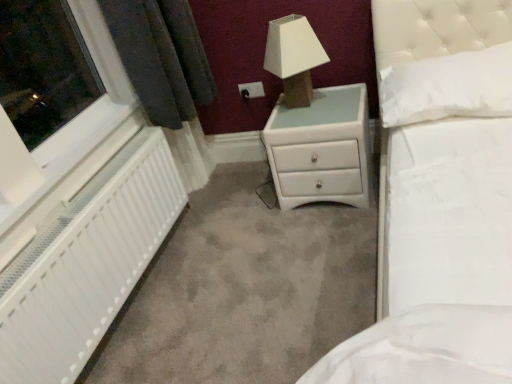
In order to click on white textured radiator at left in this screenshot , I will do `click(87, 264)`.

This screenshot has width=512, height=384. Describe the element at coordinates (54, 97) in the screenshot. I see `white plastic window at left` at that location.

Describe the element at coordinates (448, 87) in the screenshot. I see `white soft pillow at upper right` at that location.

In order to face white glossy chest of drawers at center, should I rotate leftwards or rightwards?

You should rotate right by 8.863 degrees.

This screenshot has width=512, height=384. What do you see at coordinates (321, 148) in the screenshot?
I see `white glossy chest of drawers at center` at bounding box center [321, 148].

You are a GUI agent. You are given a task and a screenshot of the screen. Output one action in this format:
    pyautogui.click(x=<x>, y=<y>)
    Task: Click on the white fabric lampshade at upper center
    The width and height of the screenshot is (512, 384).
    Given the screenshot: What is the action you would take?
    pyautogui.click(x=293, y=57)

Looking at this image, between white fabric lampshade at upper center and white plastic window at left, which one has smaller size?

With smaller size is white plastic window at left.

What's the angular difference between white fabric lampshade at upper center and white plastic window at left's facing directions?

The angle between the facing direction of white fabric lampshade at upper center and the facing direction of white plastic window at left is 90.3 degrees.

From a real-world perspective, which object stands above the other?

white fabric lampshade at upper center is physically above.

Which object is closer to the camera, white fabric lampshade at upper center or white plastic window at left?

Positioned in front is white plastic window at left.

Which is correct: white fabric lampshade at upper center is inside white textured radiator at left, or outside of it?

white fabric lampshade at upper center lies outside white textured radiator at left.

In the image, there is a white textured radiator at left. At what (x,y) coordinates should I click in order to perform the action: click on lamp above it (from the image's perspective). Please return your answer as a coordinate pair (x, y). The image size is (512, 384). Looking at the image, I should click on [x=293, y=57].

Is white fabric lampshade at upper center shorter than white textured radiator at left?

Indeed, white fabric lampshade at upper center has a lesser height compared to white textured radiator at left.

Does point (276, 67) come closer to viewer compared to point (31, 317)?

No, (276, 67) is further to viewer.

Does white glossy chest of drawers at center have a smaller size compared to white soft pillow at upper right?

Incorrect, white glossy chest of drawers at center is not smaller in size than white soft pillow at upper right.

Is white glossy chest of drawers at center next to white soft pillow at upper right and touching it?

white glossy chest of drawers at center and white soft pillow at upper right are not in contact.

Who is shorter, white glossy chest of drawers at center or white soft pillow at upper right?

With less height is white soft pillow at upper right.

Is white soft pillow at upper right inside white glossy chest of drawers at center?

No, white soft pillow at upper right is located outside of white glossy chest of drawers at center.

Which of these two, white soft pillow at upper right or white plastic electric outlet at upper center, is thinner?

With smaller width is white plastic electric outlet at upper center.

Image resolution: width=512 pixels, height=384 pixels. In order to click on pillow that is above the white plastic electric outlet at upper center (from a real-world perspective) in this screenshot , I will do `click(448, 87)`.

Does white soft pillow at upper right have a lesser height compared to white plastic electric outlet at upper center?

No.

Based on their sizes in the image, would you say white soft pillow at upper right is bigger or smaller than white plastic electric outlet at upper center?

In the image, white soft pillow at upper right appears to be larger than white plastic electric outlet at upper center.

From a real-world perspective, is white textured radiator at left on top of white glossy chest of drawers at center?

Indeed, from a real-world perspective, white textured radiator at left stands above white glossy chest of drawers at center.

Where is `radiator below the white glossy chest of drawers at center (from the image's perspective)`? Image resolution: width=512 pixels, height=384 pixels. radiator below the white glossy chest of drawers at center (from the image's perspective) is located at coordinates (87, 264).

Is white textured radiator at left outside of white glossy chest of drawers at center?

Indeed, white textured radiator at left is completely outside white glossy chest of drawers at center.

Considering the sizes of objects white textured radiator at left and white glossy chest of drawers at center in the image provided, who is wider, white textured radiator at left or white glossy chest of drawers at center?

white glossy chest of drawers at center is wider.

Who is bigger, white plastic electric outlet at upper center or white textured radiator at left?

With larger size is white textured radiator at left.

Considering the positions of objects white plastic electric outlet at upper center and white textured radiator at left in the image provided, who is in front, white plastic electric outlet at upper center or white textured radiator at left?

white textured radiator at left is in front.

Considering the sizes of objects white plastic electric outlet at upper center and white textured radiator at left in the image provided, who is taller, white plastic electric outlet at upper center or white textured radiator at left?

white textured radiator at left.

From the image's perspective, would you say white plastic electric outlet at upper center is shown under white textured radiator at left?

Incorrect, from the image's perspective, white plastic electric outlet at upper center is higher than white textured radiator at left.

Which is further, (280,109) or (26,361)?

The point (280,109) is farther.

Which of these two, white glossy chest of drawers at center or white textured radiator at left, stands taller?

Standing taller between the two is white textured radiator at left.

Image resolution: width=512 pixels, height=384 pixels. Find the location of `the chest of drawers behind the white textured radiator at left`. the chest of drawers behind the white textured radiator at left is located at coordinates (321, 148).

At what (x,y) coordinates should I click in order to perform the action: click on window below the white fabric lampshade at upper center (from the image's perspective). Please return your answer as a coordinate pair (x, y). The height and width of the screenshot is (384, 512). Looking at the image, I should click on (54, 97).

This screenshot has height=384, width=512. What are the coordinates of `radiator below the white fabric lampshade at upper center (from a real-world perspective)` in the screenshot? It's located at (87, 264).

When comparing their distances from white fabric lampshade at upper center, does white glossy chest of drawers at center or white textured radiator at left seem closer?

white glossy chest of drawers at center.

Which object lies further to the anchor point white plastic electric outlet at upper center, white fabric lampshade at upper center or white textured radiator at left?

white textured radiator at left.

From the image, which object appears to be farther from white textured radiator at left, white plastic electric outlet at upper center or white glossy chest of drawers at center?

white plastic electric outlet at upper center lies further to white textured radiator at left than the other object.

Looking at the image, which one is located closer to white plastic window at left, white glossy chest of drawers at center or white plastic electric outlet at upper center?

white glossy chest of drawers at center lies closer to white plastic window at left than the other object.

Considering their positions, is white fabric lampshade at upper center positioned further to white textured radiator at left than white plastic electric outlet at upper center?

Based on the image, white plastic electric outlet at upper center appears to be further to white textured radiator at left.

Looking at the image, which one is located further to white plastic electric outlet at upper center, white textured radiator at left or white soft pillow at upper right?

white textured radiator at left is positioned further to the anchor white plastic electric outlet at upper center.

Considering their positions, is white plastic window at left positioned closer to white fabric lampshade at upper center than white plastic electric outlet at upper center?

The object closer to white fabric lampshade at upper center is white plastic electric outlet at upper center.

From the image, which object appears to be nearer to white plastic electric outlet at upper center, white fabric lampshade at upper center or white glossy chest of drawers at center?

Based on the image, white fabric lampshade at upper center appears to be nearer to white plastic electric outlet at upper center.

Locate an element on the screen. The image size is (512, 384). lamp between white textured radiator at left and white glossy chest of drawers at center in the horizontal direction is located at coordinates (293, 57).

Image resolution: width=512 pixels, height=384 pixels. Identify the location of radiator between white plastic window at left and white soft pillow at upper right from left to right. click(x=87, y=264).

Image resolution: width=512 pixels, height=384 pixels. In order to click on lamp between white soft pillow at upper right and white plastic electric outlet at upper center along the z-axis in this screenshot , I will do `click(293, 57)`.

Locate an element on the screen. The width and height of the screenshot is (512, 384). the chest of drawers located between white plastic window at left and white soft pillow at upper right in the left-right direction is located at coordinates (321, 148).